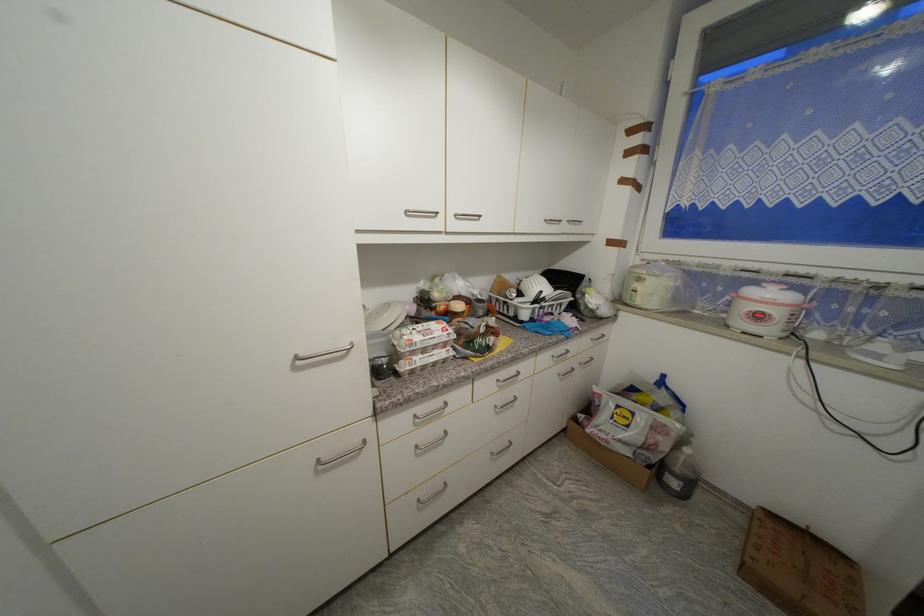
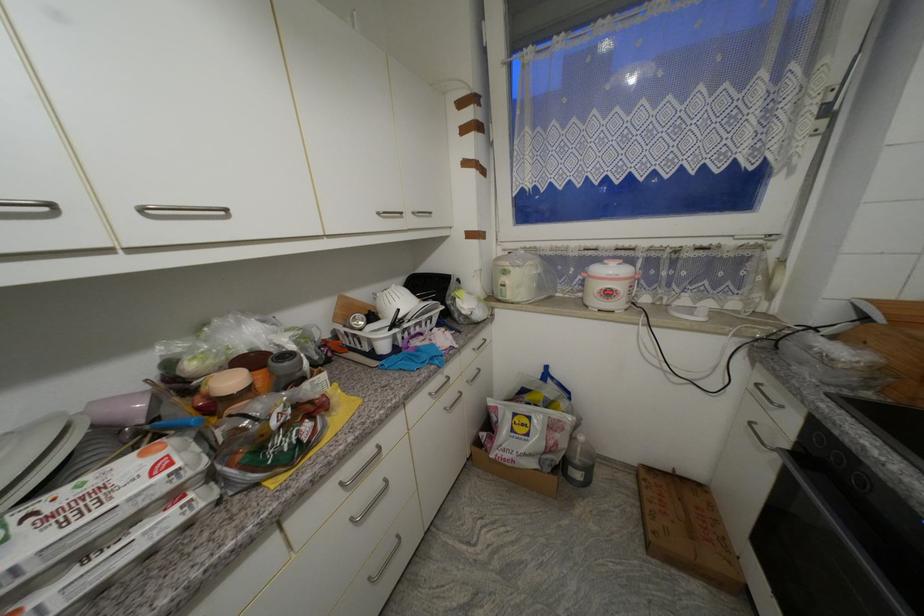
The point at (569, 368) is marked in the first image. Where is the corresponding point in the second image?

(455, 398)